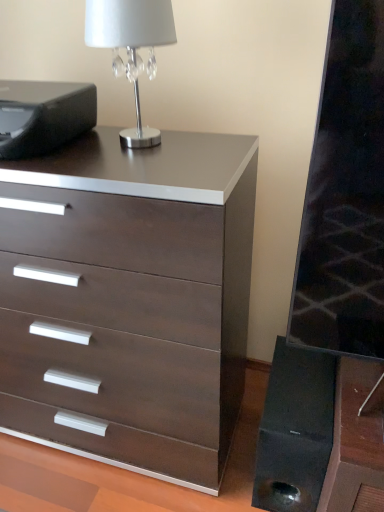
Question: Does dark wood/matte chest of drawers at center come in front of silver metallic table lamp at upper left?

Choices:
 (A) no
 (B) yes

Answer: (B)

Question: Are dark wood/matte chest of drawers at center and silver metallic table lamp at upper left far apart?

Choices:
 (A) yes
 (B) no

Answer: (B)

Question: Does dark wood/matte chest of drawers at center come behind silver metallic table lamp at upper left?

Choices:
 (A) no
 (B) yes

Answer: (A)

Question: Considering the relative sizes of dark wood/matte chest of drawers at center and silver metallic table lamp at upper left in the image provided, is dark wood/matte chest of drawers at center taller than silver metallic table lamp at upper left?

Choices:
 (A) yes
 (B) no

Answer: (A)

Question: Is dark wood/matte chest of drawers at center positioned beyond the bounds of silver metallic table lamp at upper left?

Choices:
 (A) no
 (B) yes

Answer: (B)

Question: Is black matte printer at upper left spatially inside black matte speaker at lower right, or outside of it?

Choices:
 (A) inside
 (B) outside

Answer: (B)

Question: Relative to black matte speaker at lower right, is black matte printer at upper left in front or behind?

Choices:
 (A) front
 (B) behind

Answer: (A)

Question: From a real-world perspective, is black matte printer at upper left physically located above or below black matte speaker at lower right?

Choices:
 (A) above
 (B) below

Answer: (A)

Question: From their relative heights in the image, would you say black matte printer at upper left is taller or shorter than black matte speaker at lower right?

Choices:
 (A) short
 (B) tall

Answer: (A)

Question: Considering the positions of black matte printer at upper left and silver metallic table lamp at upper left in the image, is black matte printer at upper left taller or shorter than silver metallic table lamp at upper left?

Choices:
 (A) tall
 (B) short

Answer: (B)

Question: Visually, is black matte printer at upper left positioned to the left or to the right of silver metallic table lamp at upper left?

Choices:
 (A) left
 (B) right

Answer: (A)

Question: Is black matte printer at upper left wider or thinner than silver metallic table lamp at upper left?

Choices:
 (A) thin
 (B) wide

Answer: (B)

Question: Is point (79, 123) closer or farther from the camera than point (114, 40)?

Choices:
 (A) farther
 (B) closer

Answer: (A)

Question: From the image's perspective, is silver metallic table lamp at upper left positioned above or below black matte speaker at lower right?

Choices:
 (A) above
 (B) below

Answer: (A)

Question: In terms of height, does silver metallic table lamp at upper left look taller or shorter compared to black matte speaker at lower right?

Choices:
 (A) short
 (B) tall

Answer: (A)